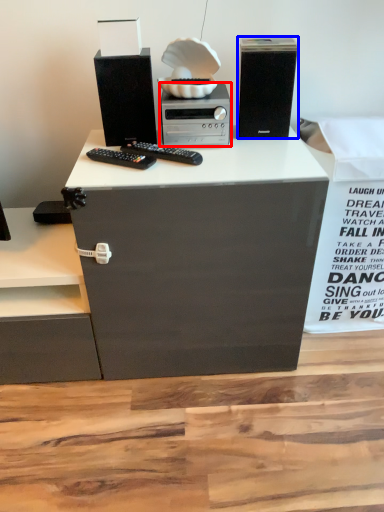
Question: Which of the following is the closest to the observer, home appliance (highlighted by a red box) or computer tower (highlighted by a blue box)?

Choices:
 (A) home appliance
 (B) computer tower

Answer: (B)